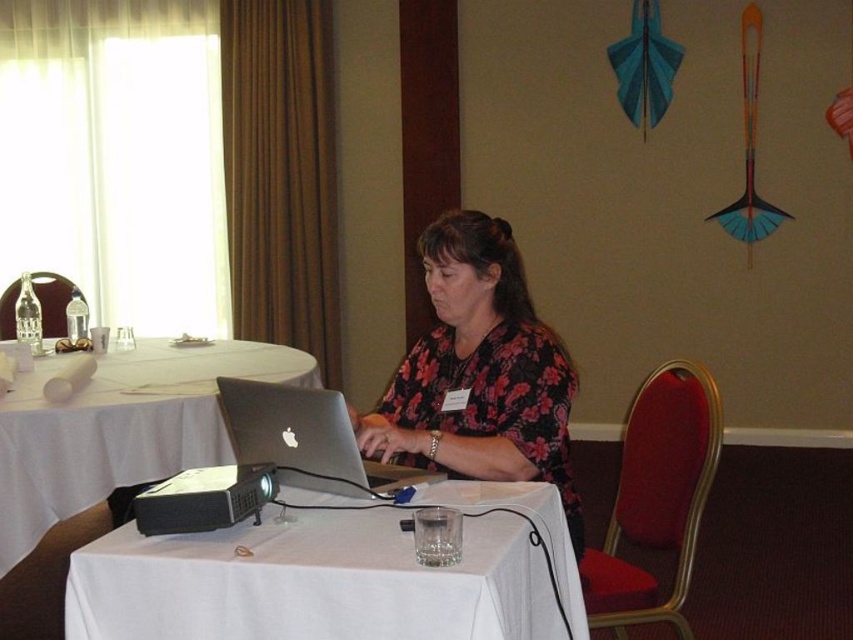
Question: Where is floral fabric shirt at center located in relation to white cloth table at center in the image?

Choices:
 (A) below
 (B) above

Answer: (B)

Question: Which is farther from the white cloth table at center?

Choices:
 (A) floral fabric shirt at center
 (B) silver metallic laptop at center

Answer: (B)

Question: Which of these objects is positioned farthest from the white cloth table at center?

Choices:
 (A) white cloth-covered table at center
 (B) floral fabric shirt at center

Answer: (A)

Question: Can you confirm if white cloth-covered table at center is positioned below silver metallic laptop at center?

Choices:
 (A) yes
 (B) no

Answer: (A)

Question: Is the position of white cloth-covered table at center more distant than that of silver metallic laptop at center?

Choices:
 (A) yes
 (B) no

Answer: (B)

Question: Which point is closer to the camera?

Choices:
 (A) floral fabric shirt at center
 (B) white cloth-covered table at center
 (C) silver metallic laptop at center

Answer: (B)